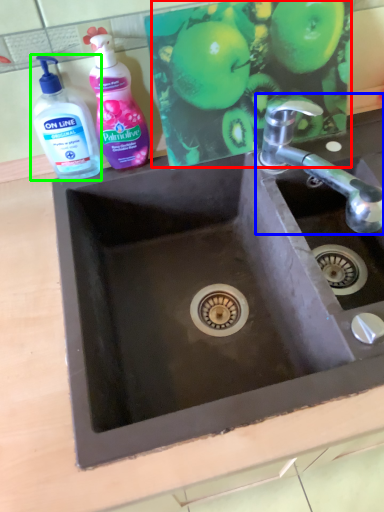
Question: Based on their relative distances, which object is nearer to apple (highlighted by a red box)? Choose from tap (highlighted by a blue box) and bottle (highlighted by a green box).

Choices:
 (A) tap
 (B) bottle

Answer: (A)